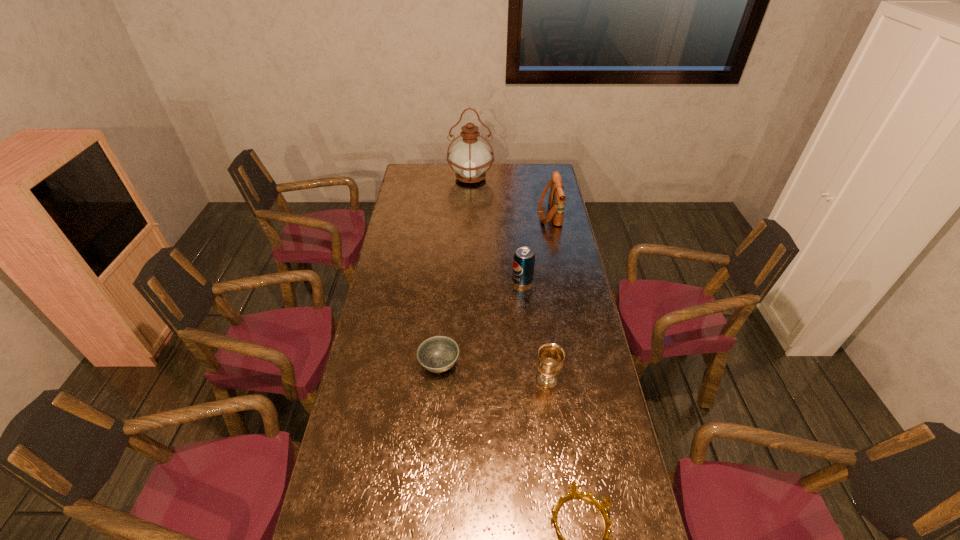
What are the coordinates of `the tallest object` in the screenshot? It's located at (470, 158).

The width and height of the screenshot is (960, 540). I want to click on oil lamp, so click(470, 158).

Where is `shoulder bag`? This screenshot has width=960, height=540. shoulder bag is located at coordinates (557, 197).

I want to click on the fourth nearest object, so click(524, 258).

This screenshot has width=960, height=540. What are the coordinates of `chalice` in the screenshot? It's located at (550, 360).

Locate an element on the screen. The height and width of the screenshot is (540, 960). bowl is located at coordinates (437, 354).

At what (x,y) coordinates should I click in order to perform the action: click on free space located 0.240m on the right of the tallest object. Please return your answer as a coordinate pair (x, y). The height and width of the screenshot is (540, 960). Looking at the image, I should click on (538, 178).

This screenshot has height=540, width=960. Identify the location of vacant space located 0.240m on the front-facing side of the fifth nearest object. (490, 214).

You are a GUI agent. You are given a task and a screenshot of the screen. Output one action in this format:
    pyautogui.click(x=<x>, y=<y>)
    Task: Click on the vacant area situated 0.380m on the front-facing side of the fifth nearest object
    
    Given the screenshot: What is the action you would take?
    pyautogui.click(x=461, y=214)

At what (x,y) coordinates should I click in order to perform the action: click on vacant space located 0.300m on the front-facing side of the fifth nearest object. Please return your answer as a coordinate pair (x, y). This screenshot has width=960, height=540. Looking at the image, I should click on (477, 214).